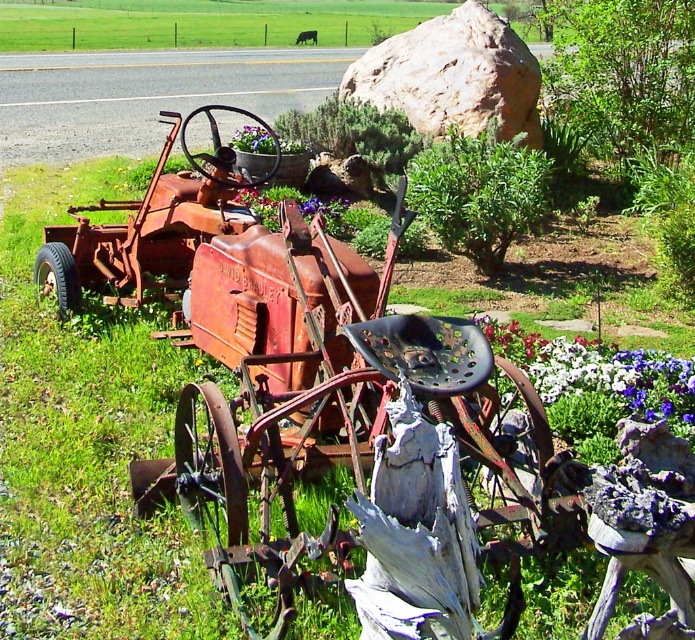
Question: Which of these objects is positioned farthest from the rustic stone boulder at center?

Choices:
 (A) purple fabric flower at lower right
 (B) purple fabric flower bed at center
 (C) purple fabric flower at center

Answer: (A)

Question: Estimate the real-world distances between objects in this image. Which object is farther from the purple fabric flower at lower right?

Choices:
 (A) purple fabric flower bed at center
 (B) purple fabric flower at center
 (C) rustic stone boulder at center

Answer: (B)

Question: Is purple fabric flower bed at center smaller than purple fabric flower at center?

Choices:
 (A) yes
 (B) no

Answer: (A)

Question: Where is rustic stone boulder at center located in relation to purple fabric flower bed at center in the image?

Choices:
 (A) below
 (B) above

Answer: (B)

Question: Estimate the real-world distances between objects in this image. Which object is closer to the purple fabric flower at lower right?

Choices:
 (A) rustic stone boulder at center
 (B) purple fabric flower bed at center
 (C) purple fabric flower at center

Answer: (A)

Question: Does rustic stone boulder at center have a greater width compared to purple fabric flower at center?

Choices:
 (A) yes
 (B) no

Answer: (A)